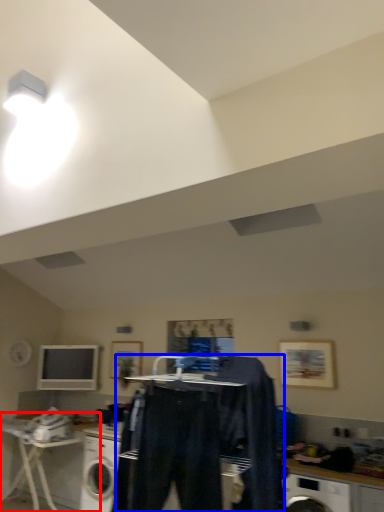
Question: Among these objects, which one is nearest to the camera, table (highlighted by a red box) or clothing (highlighted by a blue box)?

Choices:
 (A) table
 (B) clothing

Answer: (B)